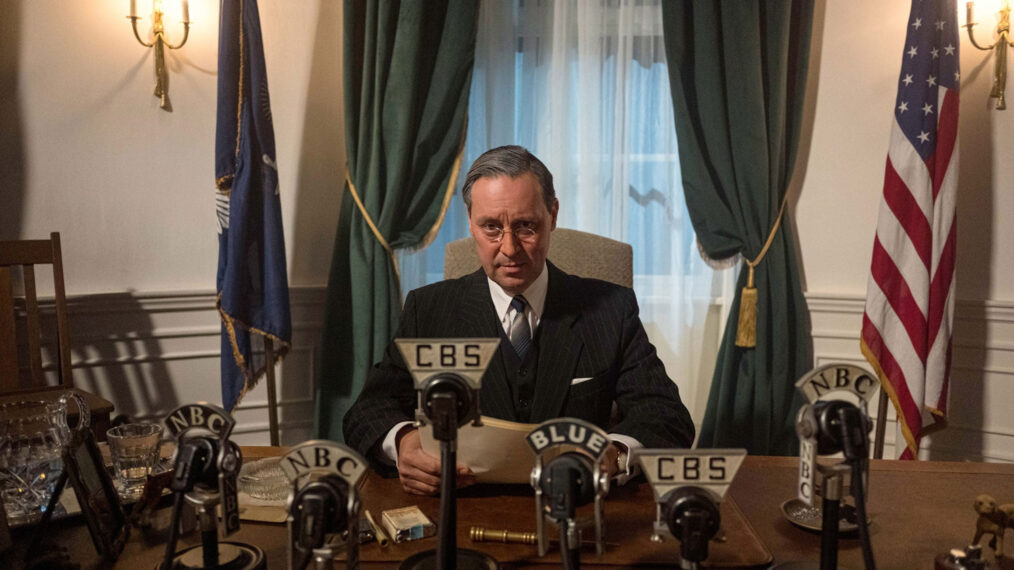
I want to click on chair, so click(27, 286).